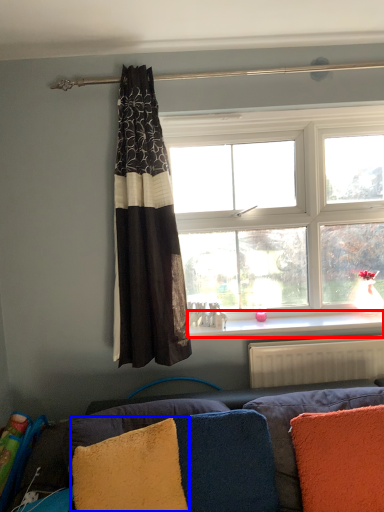
Question: Among these objects, which one is farthest to the camera, window sill (highlighted by a red box) or pillow (highlighted by a blue box)?

Choices:
 (A) window sill
 (B) pillow

Answer: (A)